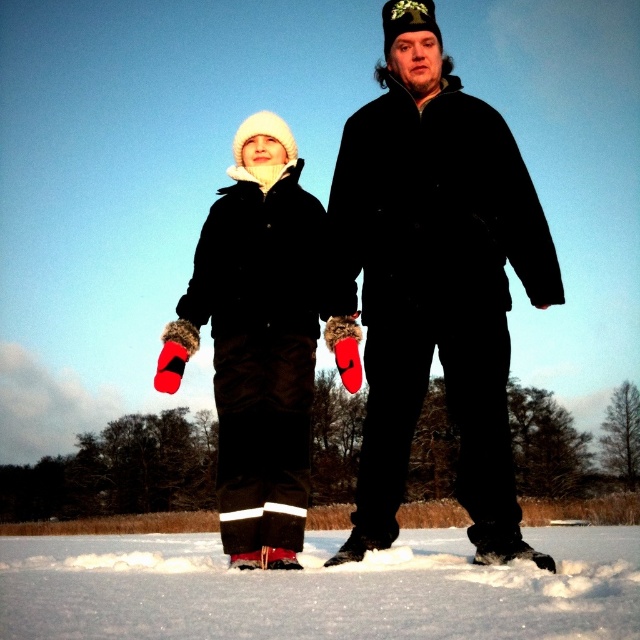
You are a photographer trying to capture a closeup shot of the matte black coat at center and the fuzzy red mittens at left. Your camera has a maximum focus range of 1.5 meters. Can you take the photo without moving either object?

The matte black coat at center is 1.58 meters away from the fuzzy red mittens at left. Since the distance between them is slightly more than the camera can focus within, you cannot take the photo without moving them closer together.

You are trying to decide whether to place a small snowman between the two people. The snowman needs a base that must be wider than the fuzzy red mittens at left. Can the white fluffy snow at lower center provide enough width for the base?

The white fluffy snow at lower center is wider than the fuzzy red mittens at left, so yes, it can provide enough width for the snowman base.